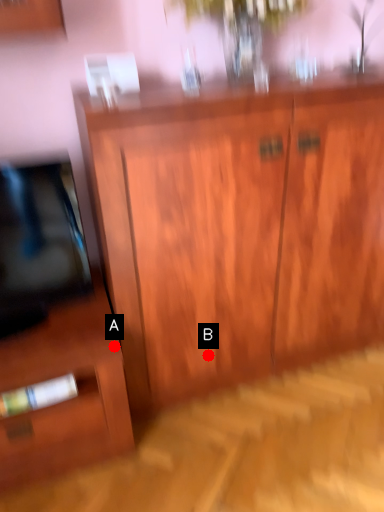
Question: Two points are circled on the image, labeled by A and B beside each circle. Which of the following is the farthest from the observer?

Choices:
 (A) A is further
 (B) B is further

Answer: (B)